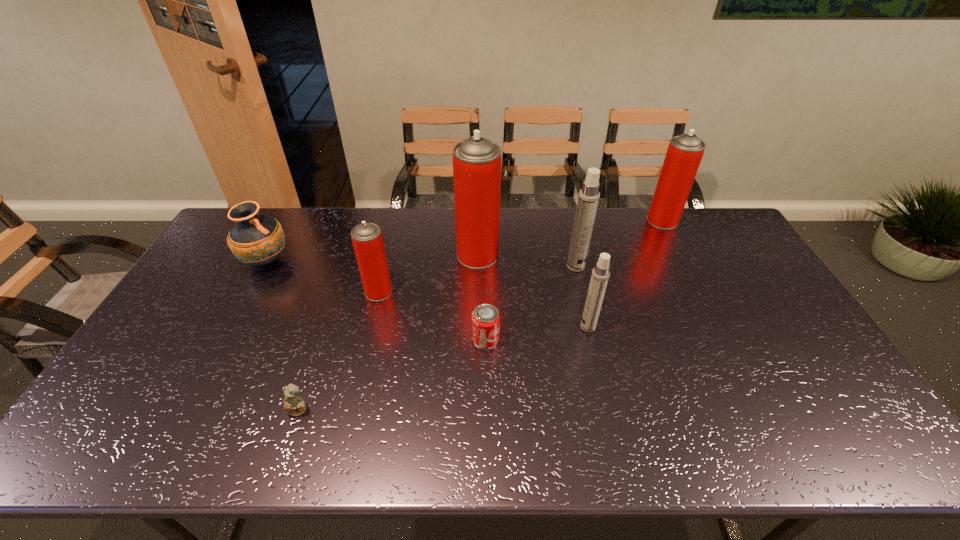
At what (x,y) coordinates should I click in order to perform the action: click on the second nearest red aerosol can. Please return your answer as a coordinate pair (x, y). This screenshot has height=540, width=960. Looking at the image, I should click on (476, 161).

Identify the location of the fourth aerosol can from right to left. (476, 161).

The width and height of the screenshot is (960, 540). Identify the location of the farthest object. (684, 154).

Locate an element on the screen. The height and width of the screenshot is (540, 960). the rightmost red aerosol can is located at coordinates (684, 154).

I want to click on the farther white aerosol can, so click(x=588, y=199).

Where is `the leftmost red aerosol can`? Image resolution: width=960 pixels, height=540 pixels. the leftmost red aerosol can is located at coordinates (367, 239).

Image resolution: width=960 pixels, height=540 pixels. Find the location of `the sixth object from right to left`. the sixth object from right to left is located at coordinates (367, 239).

This screenshot has width=960, height=540. I want to click on the nearest aerosol can, so click(x=600, y=275).

Find the location of `the nearer white aerosol can`. the nearer white aerosol can is located at coordinates (600, 275).

Locate an element on the screen. This screenshot has width=960, height=540. the leftmost object is located at coordinates (256, 239).